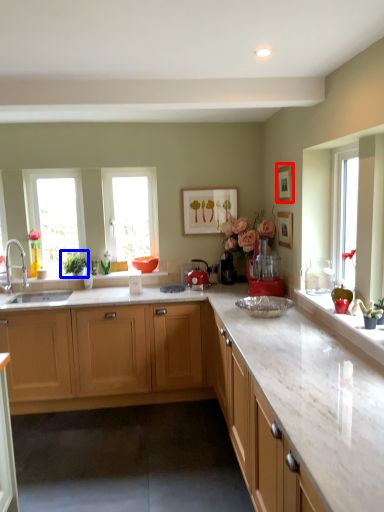
Question: Which of the following is the closest to the observer, picture frame (highlighted by a red box) or plant (highlighted by a blue box)?

Choices:
 (A) picture frame
 (B) plant

Answer: (A)